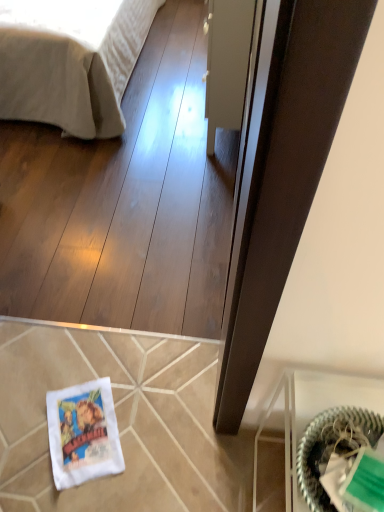
Question: From their relative heights in the image, would you say white fabric bag at lower left is taller or shorter than green woven basket at lower right?

Choices:
 (A) tall
 (B) short

Answer: (B)

Question: From the image's perspective, relative to green woven basket at lower right, is white fabric bag at lower left above or below?

Choices:
 (A) below
 (B) above

Answer: (A)

Question: Which object is the farthest from the beige cotton bed at upper left?

Choices:
 (A) green woven basket at lower right
 (B) transparent glass door at center
 (C) white fabric bag at lower left

Answer: (A)

Question: Based on their relative distances, which object is farther from the transparent glass door at center?

Choices:
 (A) white fabric bag at lower left
 (B) green woven basket at lower right
 (C) beige cotton bed at upper left

Answer: (B)